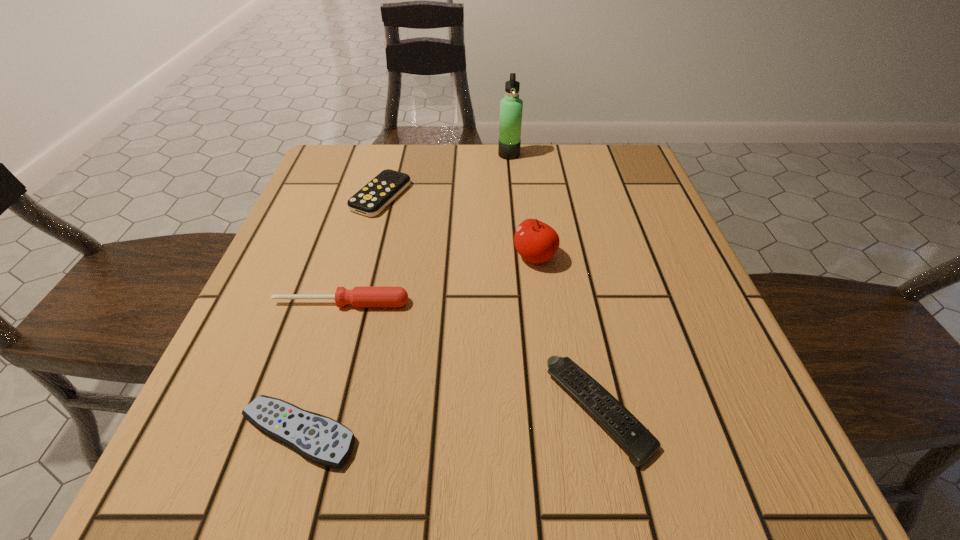
Find the location of a particular element. free area in between the third farthest object and the farthest remote control is located at coordinates (458, 226).

The width and height of the screenshot is (960, 540). In order to click on empty location between the shortest remote control and the fifth shortest object in this screenshot , I will do `click(417, 345)`.

Find the location of a particular element. This screenshot has width=960, height=540. vacant area that lies between the tallest object and the farthest remote control is located at coordinates (445, 176).

At what (x,y) coordinates should I click in order to perform the action: click on vacant space in between the third tallest object and the farthest remote control. Please return your answer as a coordinate pair (x, y). Looking at the image, I should click on (361, 249).

Identify the location of unoccupied area between the third tallest object and the shortest object. (320, 368).

Locate an element on the screen. The height and width of the screenshot is (540, 960). free space between the farthest remote control and the fourth nearest object is located at coordinates (458, 226).

At what (x,y) coordinates should I click in order to perform the action: click on object that is the second closest to the third nearest object. Please return your answer as a coordinate pair (x, y). The image size is (960, 540). Looking at the image, I should click on pos(535,241).

Find the location of a particular element. The width and height of the screenshot is (960, 540). object that is the closest one to the rightmost remote control is located at coordinates (535, 241).

The width and height of the screenshot is (960, 540). I want to click on the second closest remote control to the third tallest object, so pos(376,195).

The height and width of the screenshot is (540, 960). In order to click on remote control object that ranks as the third closest to the thermos bottle in this screenshot , I will do `click(318, 438)`.